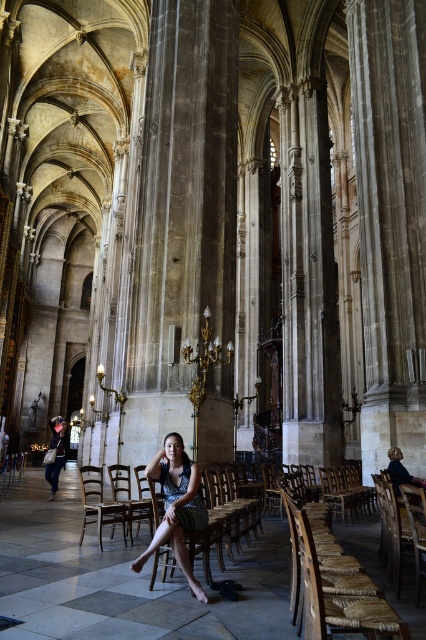
Question: Does dark blue dotted dress at center appear over wooden chair at center?

Choices:
 (A) yes
 (B) no

Answer: (A)

Question: Can you confirm if dark blue dotted dress at center is positioned above matte black dress at lower left?

Choices:
 (A) yes
 (B) no

Answer: (A)

Question: Is the position of wooden polished chair at center more distant than that of wooden chair at center?

Choices:
 (A) yes
 (B) no

Answer: (B)

Question: Which object is farther from the camera taking this photo?

Choices:
 (A) wooden chair at center
 (B) wooden polished chair at center

Answer: (A)

Question: Among these objects, which one is nearest to the camera?

Choices:
 (A) matte black dress at lower left
 (B) wooden chair at center

Answer: (B)

Question: Which point is closer to the camera taking this photo?

Choices:
 (A) (172, 483)
 (B) (85, 502)
 (C) (150, 502)
 (D) (57, 449)

Answer: (A)